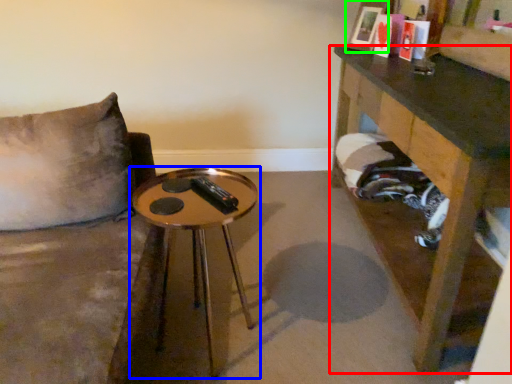
Question: Estimate the real-world distances between objects in this image. Which object is farther from table (highlighted by a red box), table (highlighted by a blue box) or picture frame (highlighted by a green box)?

Choices:
 (A) table
 (B) picture frame

Answer: (A)